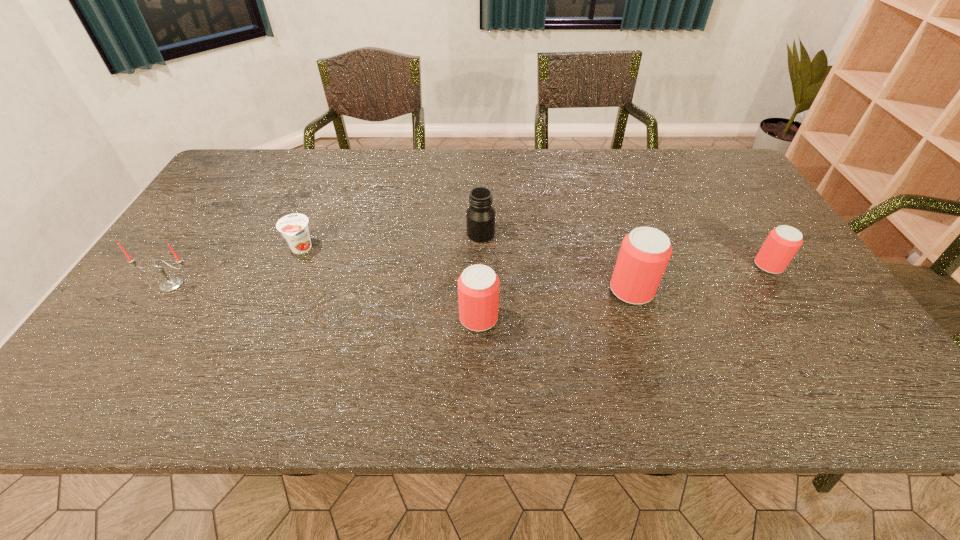
In the current image, all beer cans are evenly spaced. To maintain this equal spacing, where should an additional beer can be placed on the left? Please point out a free spot. Please provide its 2D coordinates. Your answer should be formatted as a tuple, i.e. [(x, y)], where the tuple contains the x and y coordinates of a point satisfying the conditions above.

[(306, 349)]